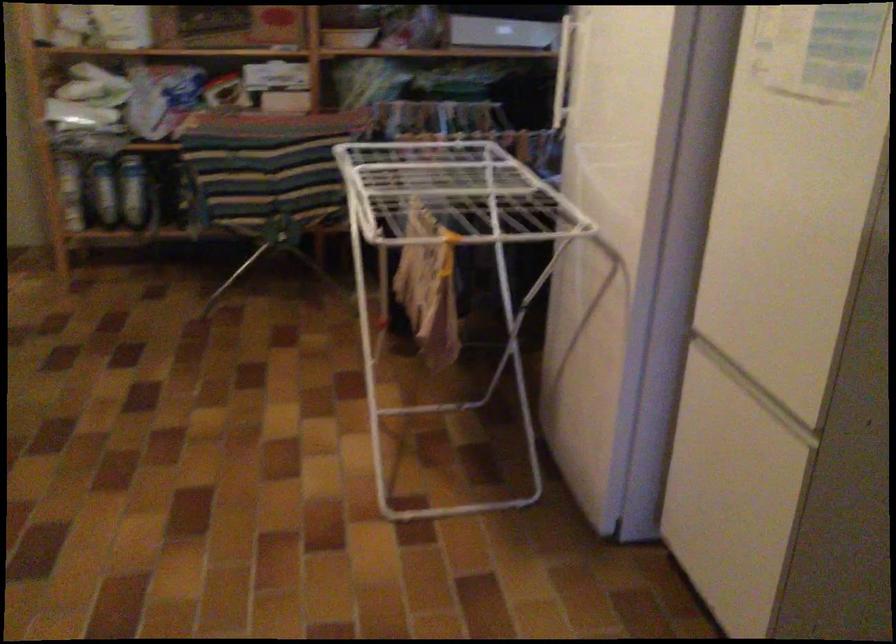
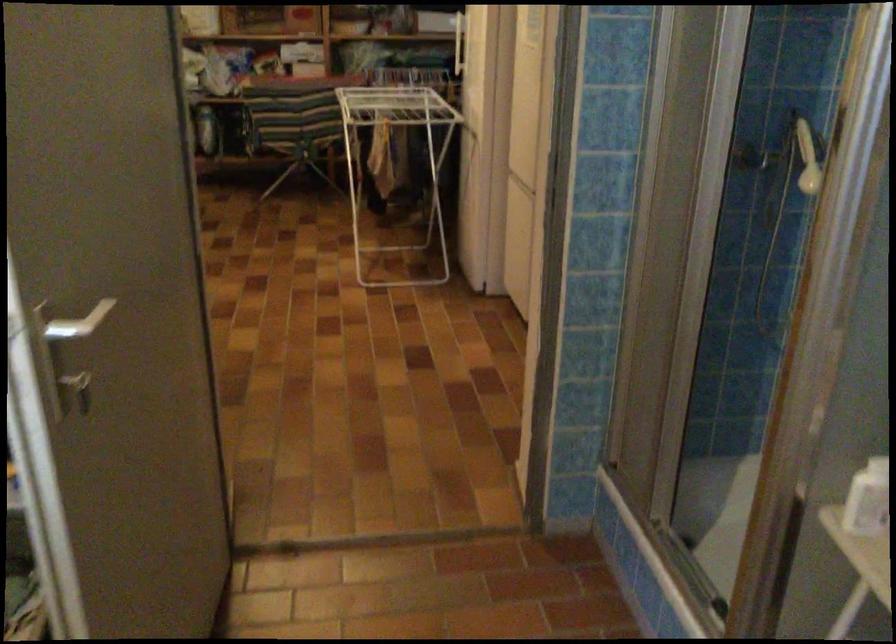
Where in the second image is the point corresponding to (307,198) from the first image?

(306, 128)